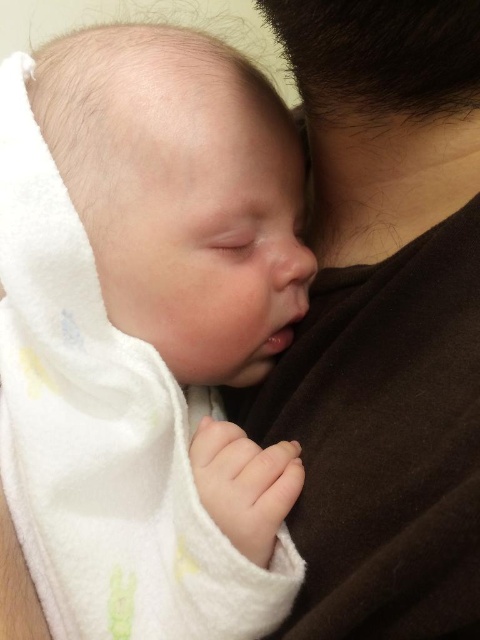
Question: Is white soft towel at center above brown soft fabric at upper right?

Choices:
 (A) no
 (B) yes

Answer: (B)

Question: Which object appears closest to the camera in this image?

Choices:
 (A) white soft towel at center
 (B) brown soft fabric at upper right

Answer: (B)

Question: Which point is farther to the camera?

Choices:
 (A) white soft towel at center
 (B) brown soft fabric at upper right

Answer: (A)

Question: Is white soft towel at center wider than brown soft fabric at upper right?

Choices:
 (A) no
 (B) yes

Answer: (B)

Question: Does white soft towel at center have a lesser width compared to brown soft fabric at upper right?

Choices:
 (A) no
 (B) yes

Answer: (A)